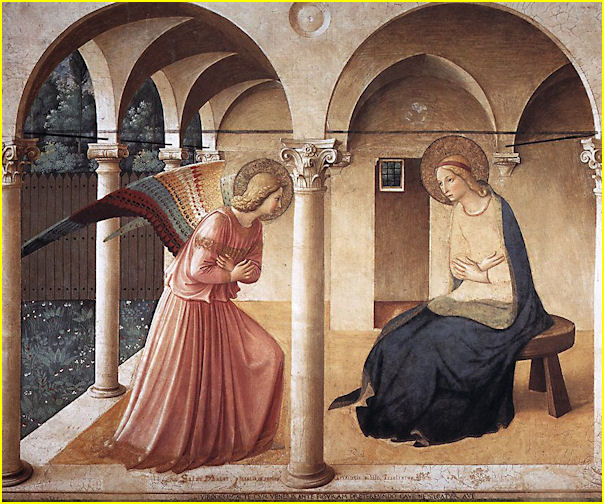
Where is `window`? window is located at coordinates (385, 167).